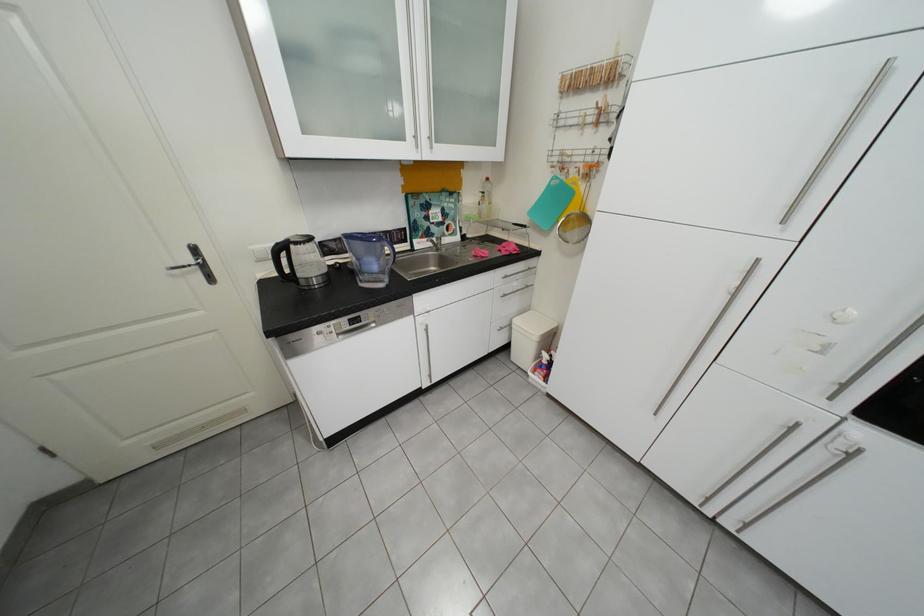
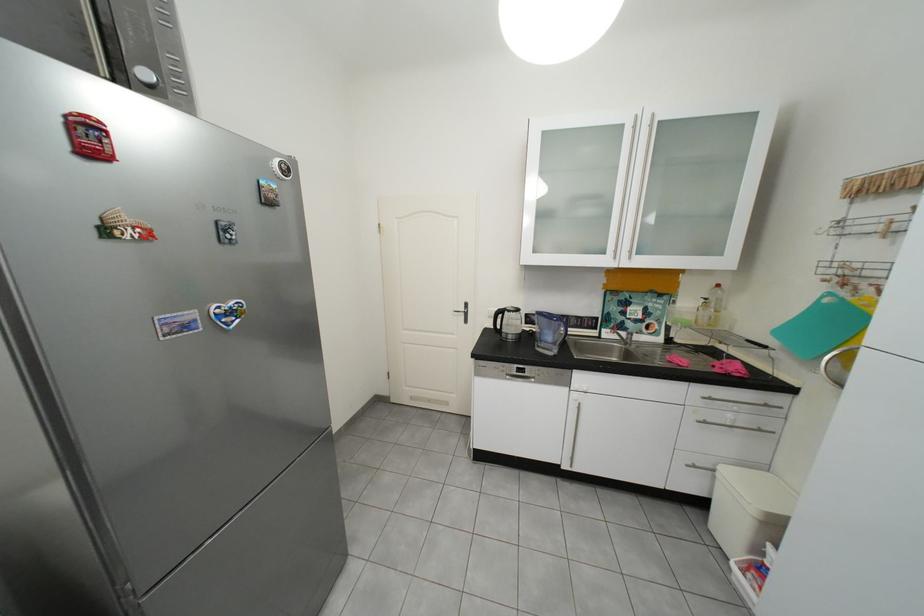
The point at (565, 179) is marked in the first image. Where is the corresponding point in the second image?

(841, 296)